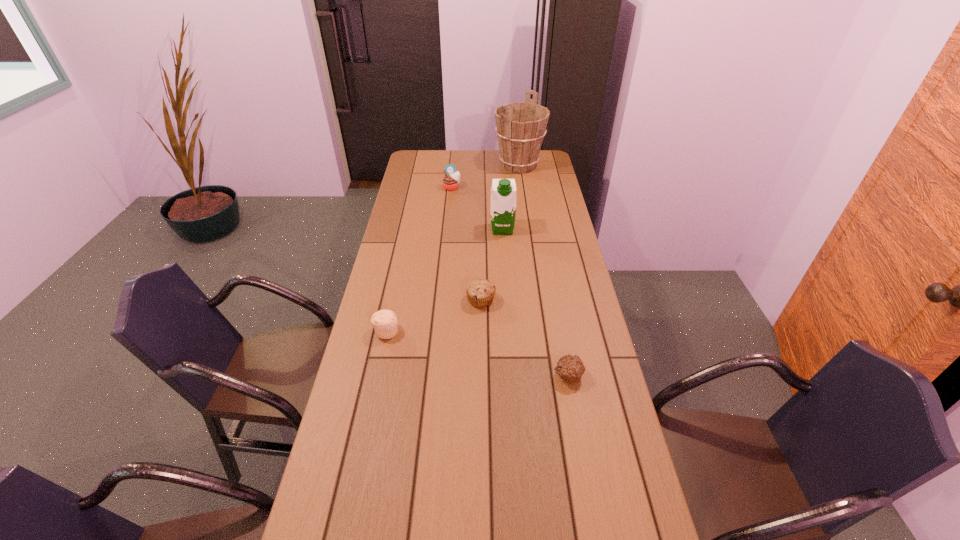
At what (x,y) coordinates should I click in order to perform the action: click on bucket that is at the right edge. Please return your answer as a coordinate pair (x, y). Image resolution: width=960 pixels, height=540 pixels. Looking at the image, I should click on (520, 126).

Locate an element on the screen. This screenshot has height=540, width=960. muffin present at the right edge is located at coordinates (570, 368).

Where is `object positioned at the far right corner`? The height and width of the screenshot is (540, 960). object positioned at the far right corner is located at coordinates (520, 126).

Locate an element on the screen. Image resolution: width=960 pixels, height=540 pixels. free space at the far edge of the desktop is located at coordinates (482, 159).

Where is `free space at the left edge of the desktop`? The height and width of the screenshot is (540, 960). free space at the left edge of the desktop is located at coordinates (415, 226).

You are a GUI agent. You are given a task and a screenshot of the screen. Output one action in this format:
    pyautogui.click(x=<x>, y=<y>)
    Task: Click on the vacant space at the right edge
    Image resolution: width=960 pixels, height=540 pixels.
    Given the screenshot: What is the action you would take?
    pyautogui.click(x=605, y=475)

This screenshot has width=960, height=540. Identify the location of vacant space at the far left corner. (427, 161).

Image resolution: width=960 pixels, height=540 pixels. Identify the location of blank space at the far right corner. (542, 168).

You are a GUI agent. You are given a task and a screenshot of the screen. Output one action in this format:
    pyautogui.click(x=<x>, y=<y>)
    Task: Click on the vacant space that's between the nearest object and the tallest muffin
    The image size is (960, 540).
    Given the screenshot: What is the action you would take?
    pyautogui.click(x=510, y=281)

I want to click on free spot between the third nearest object and the soya milk, so click(x=492, y=265).